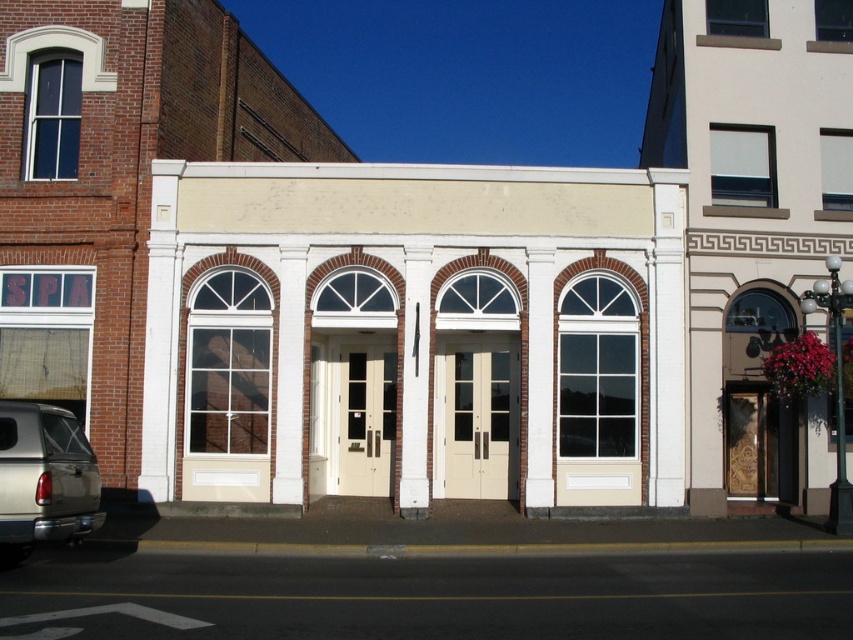
Question: Does white painted wood doors at center lie behind metallic silver truck at lower left?

Choices:
 (A) no
 (B) yes

Answer: (B)

Question: Does white painted wood doors at center have a greater width compared to metallic silver truck at lower left?

Choices:
 (A) no
 (B) yes

Answer: (B)

Question: Is white painted wood doors at center smaller than metallic silver truck at lower left?

Choices:
 (A) no
 (B) yes

Answer: (A)

Question: Which point is closer to the camera taking this photo?

Choices:
 (A) (167, 413)
 (B) (26, 435)

Answer: (B)

Question: Which of the following is the farthest from the observer?

Choices:
 (A) white painted wood doors at center
 (B) metallic silver truck at lower left

Answer: (A)